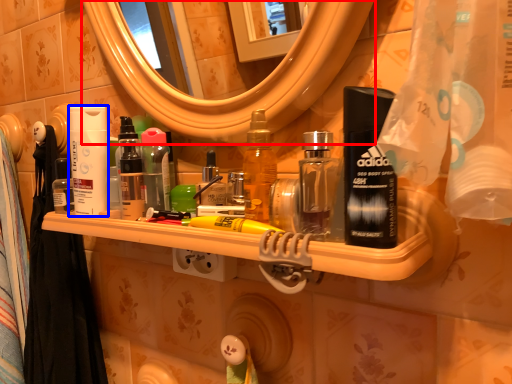
Question: Which object is further to the camera taking this photo, mirror (highlighted by a red box) or cleaning product (highlighted by a blue box)?

Choices:
 (A) mirror
 (B) cleaning product

Answer: (B)